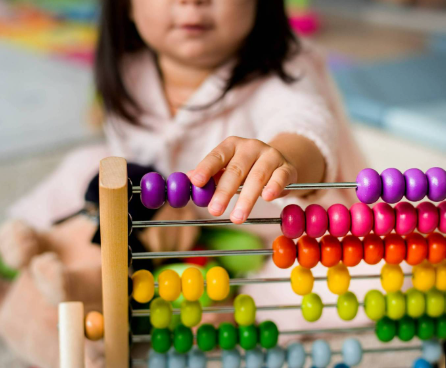
This screenshot has width=446, height=370. Identify the location of horizontal rods. (321, 185), (208, 223), (216, 250), (252, 277), (279, 307), (291, 330), (379, 350).